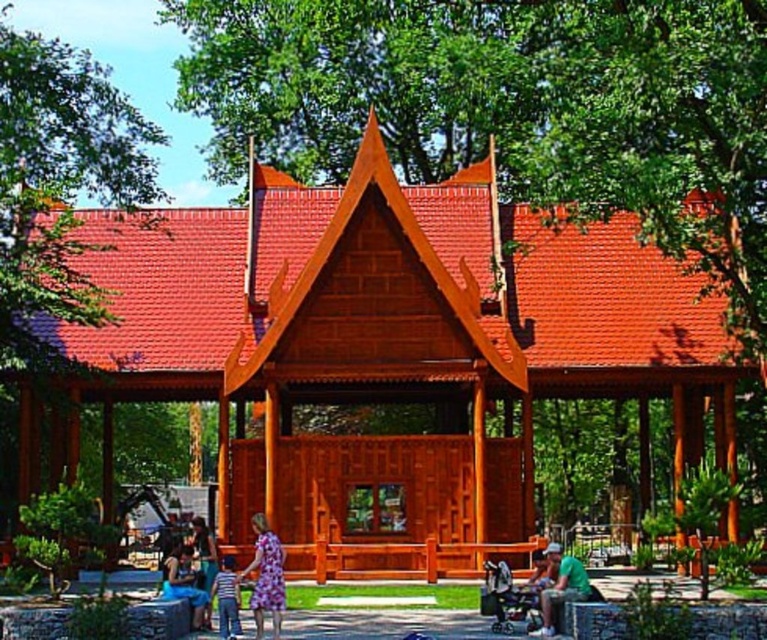
Is green leafy tree at center positioned behind green matte shirt at lower right?

Yes, green leafy tree at center is behind green matte shirt at lower right.

Does green leafy tree at center appear under green matte shirt at lower right?

No.

Where is `green leafy tree at center`? green leafy tree at center is located at coordinates (515, 108).

Is green matte shirt at lower right taller than matte blue dress at lower center?

Correct, green matte shirt at lower right is much taller as matte blue dress at lower center.

Is point (558, 602) in front of point (203, 605)?

Yes, it is in front of point (203, 605).

Find the location of a particular element. green matte shirt at lower right is located at coordinates (560, 588).

Which is below, green leafy tree at left or matte blue dress at lower center?

matte blue dress at lower center

Who is positioned more to the right, green leafy tree at left or matte blue dress at lower center?

Positioned to the right is matte blue dress at lower center.

Does point (40, 168) come behind point (189, 582)?

Yes.

The image size is (767, 640). In order to click on green leafy tree at left in this screenshot , I will do `click(58, 186)`.